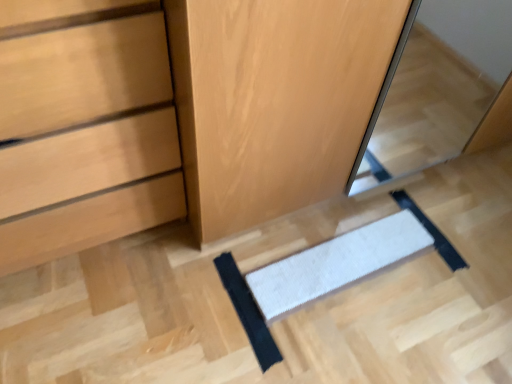
Question: Would you say wooden dresser at center is outside matte wood chest of drawers at lower left?

Choices:
 (A) no
 (B) yes

Answer: (B)

Question: Does wooden dresser at center have a larger size compared to matte wood chest of drawers at lower left?

Choices:
 (A) yes
 (B) no

Answer: (A)

Question: Does wooden dresser at center lie in front of matte wood chest of drawers at lower left?

Choices:
 (A) yes
 (B) no

Answer: (B)

Question: From the image's perspective, would you say wooden dresser at center is shown under matte wood chest of drawers at lower left?

Choices:
 (A) no
 (B) yes

Answer: (A)

Question: Is matte wood chest of drawers at lower left at the back of wooden dresser at center?

Choices:
 (A) yes
 (B) no

Answer: (B)

Question: Can you confirm if wooden dresser at center is smaller than matte wood chest of drawers at lower left?

Choices:
 (A) yes
 (B) no

Answer: (B)

Question: Is wooden dresser at center at the right side of white textured mat at center, the 2th doormat viewed from the right?

Choices:
 (A) yes
 (B) no

Answer: (A)

Question: Is wooden dresser at center far away from white textured mat at center, the 2th doormat viewed from the right?

Choices:
 (A) no
 (B) yes

Answer: (A)

Question: Is wooden dresser at center turned away from white textured mat at center, the 1th doormat viewed from the left?

Choices:
 (A) yes
 (B) no

Answer: (B)

Question: Is wooden dresser at center positioned beyond the bounds of white textured mat at center, the 1th doormat viewed from the left?

Choices:
 (A) no
 (B) yes

Answer: (B)

Question: From a real-world perspective, does wooden dresser at center sit lower than white textured mat at center, the 1th doormat viewed from the left?

Choices:
 (A) no
 (B) yes

Answer: (A)

Question: Are wooden dresser at center and white textured mat at center, the 1th doormat viewed from the left, beside each other?

Choices:
 (A) no
 (B) yes

Answer: (A)

Question: Is white textured mat at center, the 2th doormat viewed from the right, closer to camera compared to wooden dresser at center?

Choices:
 (A) yes
 (B) no

Answer: (B)